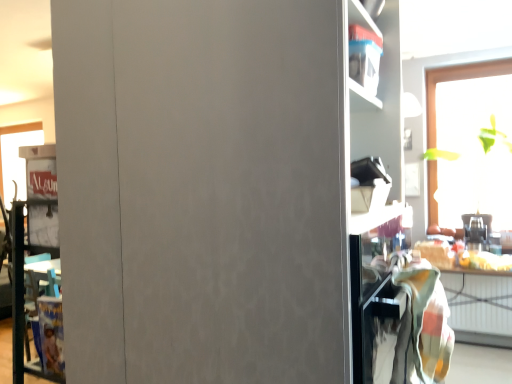
The image size is (512, 384). Describe the element at coordinates (423, 325) in the screenshot. I see `multicolored woven blanket at right` at that location.

Describe the element at coordinates (233, 190) in the screenshot. The width and height of the screenshot is (512, 384). I see `matte gray cabinet at center` at that location.

Identify the location of matte gray cabinet at center. The height and width of the screenshot is (384, 512). (233, 190).

Locate an element on the screen. metallic silver toaster at right is located at coordinates click(477, 231).

What is the approximate height of wooden table at lower right?

29.89 inches.

At what (x,y) coordinates should I click in order to perform the action: click on transparent glass window at upper right. Please return your answer as a coordinate pair (x, y). This screenshot has height=384, width=512. Looking at the image, I should click on 456,80.

Would you say metallic silver toaster at right is inside or outside transparent glass window at upper right?

The correct answer is: outside.

From the image's perspective, is metallic silver toaster at right located above or below transparent glass window at upper right?

metallic silver toaster at right is situated lower than transparent glass window at upper right in the image.

Who is taller, metallic silver toaster at right or transparent glass window at upper right?

transparent glass window at upper right.

Would you consider metallic silver toaster at right to be distant from transparent glass window at upper right?

That's not correct — metallic silver toaster at right is a little close to transparent glass window at upper right.

Where is `blanket that is below the transparent glass window at upper right (from the image's perspective)`? blanket that is below the transparent glass window at upper right (from the image's perspective) is located at coordinates (423, 325).

Is transparent glass window at upper right not near multicolored woven blanket at right?

Yes, transparent glass window at upper right and multicolored woven blanket at right are located far from each other.

From a real-world perspective, who is located lower, transparent glass window at upper right or multicolored woven blanket at right?

multicolored woven blanket at right.

What's the angular difference between transparent glass window at upper right and multicolored woven blanket at right's facing directions?

0.3 degrees separate the facing orientations of transparent glass window at upper right and multicolored woven blanket at right.

Can you confirm if wooden table at lower right is positioned to the left of transparent glass window at upper right?

Indeed, wooden table at lower right is positioned on the left side of transparent glass window at upper right.

Which of these two, wooden table at lower right or transparent glass window at upper right, stands taller?

Standing taller between the two is transparent glass window at upper right.

Could you tell me if wooden table at lower right is facing transparent glass window at upper right?

No, wooden table at lower right does not turn towards transparent glass window at upper right.

Is the position of multicolored woven blanket at right less distant than that of transparent glass window at upper right?

That is True.

From a real-world perspective, who is located lower, multicolored woven blanket at right or transparent glass window at upper right?

multicolored woven blanket at right is physically lower.

Which is more to the left, multicolored woven blanket at right or transparent glass window at upper right?

multicolored woven blanket at right.

Can wooden table at lower right be found inside transparent glass window at upper right?

No, wooden table at lower right is not inside transparent glass window at upper right.

Considering the relative sizes of transparent glass window at upper right and wooden table at lower right in the image provided, is transparent glass window at upper right wider than wooden table at lower right?

No, transparent glass window at upper right is not wider than wooden table at lower right.

Considering the relative positions of transparent glass window at upper right and wooden table at lower right in the image provided, is transparent glass window at upper right to the left or to the right of wooden table at lower right?

Based on their positions, transparent glass window at upper right is located to the right of wooden table at lower right.

Considering the positions of point (472, 76) and point (492, 316), is point (472, 76) closer or farther from the camera than point (492, 316)?

Point (472, 76) is farther from the camera than point (492, 316).

Considering the sizes of objects multicolored woven blanket at right and wooden table at lower right in the image provided, who is smaller, multicolored woven blanket at right or wooden table at lower right?

multicolored woven blanket at right is smaller.

From the picture: Is multicolored woven blanket at right positioned beyond the bounds of wooden table at lower right?

Yes, multicolored woven blanket at right is located beyond the bounds of wooden table at lower right.

Would you consider multicolored woven blanket at right to be distant from wooden table at lower right?

Yes, multicolored woven blanket at right and wooden table at lower right are located far from each other.

Measure the distance from wooden table at lower right to metallic silver toaster at right.

wooden table at lower right and metallic silver toaster at right are 18.07 inches apart.

Is wooden table at lower right positioned far away from metallic silver toaster at right?

No.

Considering the relative sizes of wooden table at lower right and metallic silver toaster at right in the image provided, is wooden table at lower right smaller than metallic silver toaster at right?

Actually, wooden table at lower right might be larger than metallic silver toaster at right.

From the image's perspective, is wooden table at lower right on top of metallic silver toaster at right?

No, from the image's perspective, wooden table at lower right is not above metallic silver toaster at right.

Identify the location of appliance lying below the transparent glass window at upper right (from the image's perspective). (477, 231).

The image size is (512, 384). Find the location of `blanket below the transparent glass window at upper right (from a real-world perspective)`. blanket below the transparent glass window at upper right (from a real-world perspective) is located at coordinates (423, 325).

When comparing their distances from multicolored woven blanket at right, does metallic silver toaster at right or wooden table at lower right seem closer?

Among the two, wooden table at lower right is located nearer to multicolored woven blanket at right.

Based on their spatial positions, is transparent glass window at upper right or metallic silver toaster at right further from multicolored woven blanket at right?

transparent glass window at upper right is further to multicolored woven blanket at right.

Considering their positions, is wooden table at lower right positioned closer to matte gray cabinet at center than multicolored woven blanket at right?

Among the two, multicolored woven blanket at right is located nearer to matte gray cabinet at center.

When comparing their distances from transparent glass window at upper right, does metallic silver toaster at right or matte gray cabinet at center seem closer?

metallic silver toaster at right.

Looking at the image, which one is located closer to wooden table at lower right, transparent glass window at upper right or multicolored woven blanket at right?

Among the two, transparent glass window at upper right is located nearer to wooden table at lower right.

When comparing their distances from matte gray cabinet at center, does multicolored woven blanket at right or metallic silver toaster at right seem further?

metallic silver toaster at right is positioned further to the anchor matte gray cabinet at center.

From the image, which object appears to be farther from transparent glass window at upper right, multicolored woven blanket at right or metallic silver toaster at right?

multicolored woven blanket at right.

Estimate the real-world distances between objects in this image. Which object is closer to matte gray cabinet at center, metallic silver toaster at right or wooden table at lower right?

wooden table at lower right is closer to matte gray cabinet at center.

Image resolution: width=512 pixels, height=384 pixels. I want to click on table positioned between matte gray cabinet at center and transparent glass window at upper right from near to far, so click(474, 298).

I want to click on appliance between multicolored woven blanket at right and transparent glass window at upper right from front to back, so click(477, 231).

Where is `blanket between matte gray cabinet at center and wooden table at lower right along the z-axis`? blanket between matte gray cabinet at center and wooden table at lower right along the z-axis is located at coordinates (423, 325).

The height and width of the screenshot is (384, 512). Find the location of `appliance positioned between matte gray cabinet at center and transparent glass window at upper right from near to far`. appliance positioned between matte gray cabinet at center and transparent glass window at upper right from near to far is located at coordinates (477, 231).